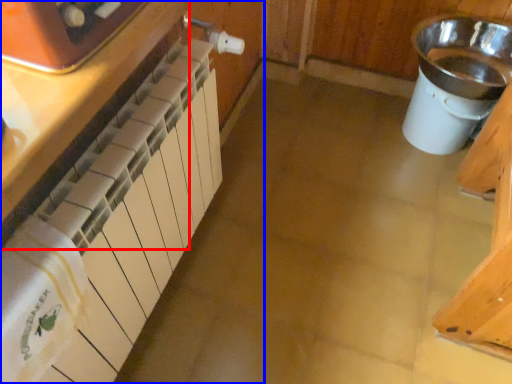
Question: Which object is further to the camera taking this photo, cabinetry (highlighted by a red box) or cabinetry (highlighted by a blue box)?

Choices:
 (A) cabinetry
 (B) cabinetry

Answer: (B)